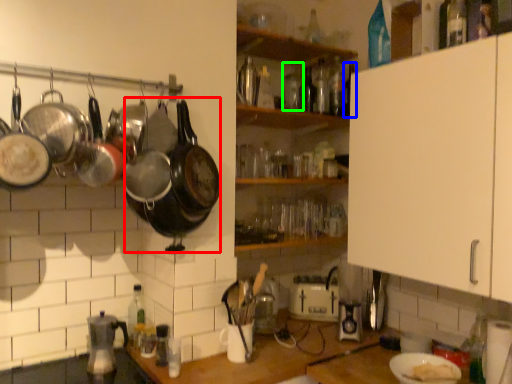
Question: Based on their relative distances, which object is nearer to wok (highlighted by a red box)? Choose from bottle (highlighted by a blue box) and bottle (highlighted by a green box).

Choices:
 (A) bottle
 (B) bottle

Answer: (B)